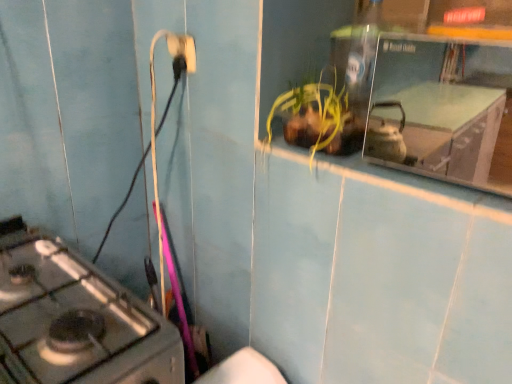
Question: From the image's perspective, does white plastic electric outlet at upper center appear lower than metallic gray gas stove at lower left?

Choices:
 (A) no
 (B) yes

Answer: (A)

Question: Are white plastic electric outlet at upper center and metallic gray gas stove at lower left making contact?

Choices:
 (A) yes
 (B) no

Answer: (B)

Question: Is white plastic electric outlet at upper center taller than metallic gray gas stove at lower left?

Choices:
 (A) no
 (B) yes

Answer: (A)

Question: Is the depth of white plastic electric outlet at upper center less than that of metallic gray gas stove at lower left?

Choices:
 (A) yes
 (B) no

Answer: (B)

Question: From a real-world perspective, is white plastic electric outlet at upper center physically above metallic gray gas stove at lower left?

Choices:
 (A) no
 (B) yes

Answer: (B)

Question: From a real-world perspective, is white plastic electric outlet at upper center located beneath metallic gray gas stove at lower left?

Choices:
 (A) yes
 (B) no

Answer: (B)

Question: Can you confirm if metallic gray gas stove at lower left is positioned to the right of white plastic electric outlet at upper center?

Choices:
 (A) no
 (B) yes

Answer: (A)

Question: From a real-world perspective, is metallic gray gas stove at lower left below white plastic electric outlet at upper center?

Choices:
 (A) no
 (B) yes

Answer: (B)

Question: From a real-world perspective, is metallic gray gas stove at lower left positioned over white plastic electric outlet at upper center based on gravity?

Choices:
 (A) no
 (B) yes

Answer: (A)

Question: Is the position of metallic gray gas stove at lower left less distant than that of white plastic electric outlet at upper center?

Choices:
 (A) yes
 (B) no

Answer: (A)

Question: Does metallic gray gas stove at lower left have a greater width compared to white plastic electric outlet at upper center?

Choices:
 (A) no
 (B) yes

Answer: (B)

Question: From the image's perspective, is metallic gray gas stove at lower left located beneath white plastic electric outlet at upper center?

Choices:
 (A) yes
 (B) no

Answer: (A)

Question: Considering the positions of point (189, 41) and point (3, 334), is point (189, 41) closer or farther from the camera than point (3, 334)?

Choices:
 (A) farther
 (B) closer

Answer: (A)